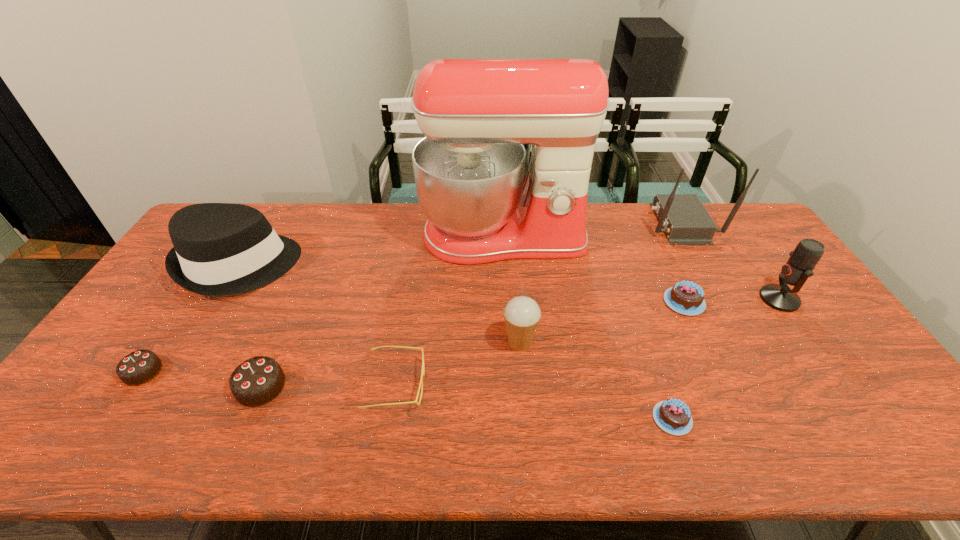
You are a GUI agent. You are given a task and a screenshot of the screen. Output one action in this format:
    pyautogui.click(x=<x>, y=<y>)
    Task: Click on the vacant region at the left edge of the desktop
    The height and width of the screenshot is (540, 960).
    Given the screenshot: What is the action you would take?
    pyautogui.click(x=164, y=293)

In the image, there is a desktop. Identify the location of free space at the right edge. (766, 261).

Locate an element on the screen. The width and height of the screenshot is (960, 540). empty space that is in between the bigger pink chocolate cake and the fedora is located at coordinates (461, 284).

Where is `free area in between the fifth shortest object and the smaller chocolate chocolate cake`? The width and height of the screenshot is (960, 540). free area in between the fifth shortest object and the smaller chocolate chocolate cake is located at coordinates click(x=202, y=379).

Find the location of `empty location between the red microphone and the icecream`. empty location between the red microphone and the icecream is located at coordinates (649, 321).

The height and width of the screenshot is (540, 960). I want to click on empty space that is in between the mixer and the right chocolate chocolate cake, so click(382, 312).

You are a GUI agent. You are given a task and a screenshot of the screen. Output one action in this format:
    pyautogui.click(x=<x>, y=<y>)
    Task: Click on the vacant point located between the smaller pink chocolate cake and the rightmost chocolate cake
    Image resolution: width=960 pixels, height=540 pixels.
    Given the screenshot: What is the action you would take?
    tap(678, 360)

Locate an element on the screen. free spot between the pink mixer and the router is located at coordinates (591, 230).

The height and width of the screenshot is (540, 960). I want to click on vacant space that's between the mixer and the black fedora, so click(371, 251).

You are a GUI agent. You are given a task and a screenshot of the screen. Output one action in this format:
    pyautogui.click(x=<x>, y=<y>)
    Task: Click on the vacant area that lies between the farthest chocolate cake and the icecream
    Image resolution: width=960 pixels, height=540 pixels.
    Given the screenshot: What is the action you would take?
    pyautogui.click(x=602, y=322)